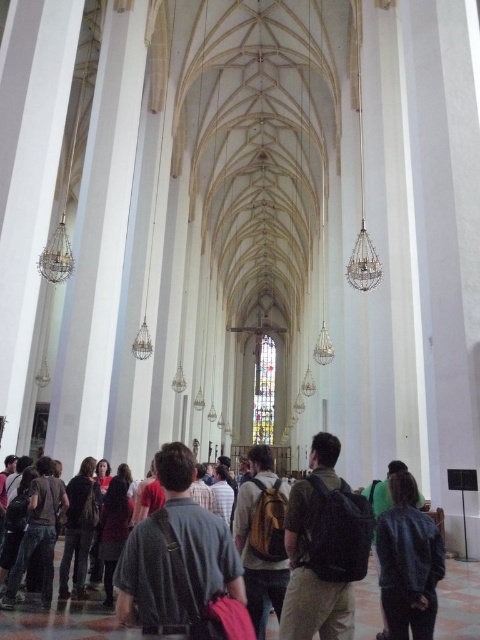
Question: Is yellow canvas backpack at center above dark gray backpack at lower left?

Choices:
 (A) no
 (B) yes

Answer: (A)

Question: Does dark gray backpack at center have a greater width compared to yellow canvas backpack at center?

Choices:
 (A) yes
 (B) no

Answer: (A)

Question: Which point is closer to the camera taking this photo?

Choices:
 (A) (43, 568)
 (B) (304, 577)
 (C) (259, 532)

Answer: (B)

Question: Which object appears farthest from the camera in this image?

Choices:
 (A) stained glass window at center
 (B) dark gray backpack at center

Answer: (A)

Question: Does dark brown backpack at center come behind denim jacket at lower right?

Choices:
 (A) yes
 (B) no

Answer: (B)

Question: Among these objects, which one is nearest to the camera?

Choices:
 (A) stained glass window at center
 (B) dark brown leather jacket at center
 (C) yellow canvas backpack at center

Answer: (C)